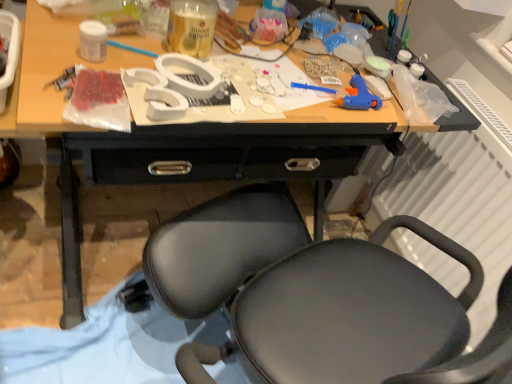
Question: Is blue plastic glue gun at right not inside translucent plastic bottle at upper center, positioned as the first bottle in back-to-front order?

Choices:
 (A) no
 (B) yes

Answer: (B)

Question: Is blue plastic glue gun at right positioned far away from translucent plastic bottle at upper center, the 3th bottle from the front?

Choices:
 (A) yes
 (B) no

Answer: (B)

Question: Could you tell me if blue plastic glue gun at right is turned towards translucent plastic bottle at upper center, acting as the third bottle starting from the left?

Choices:
 (A) no
 (B) yes

Answer: (A)

Question: Is blue plastic glue gun at right further to camera compared to translucent plastic bottle at upper center, positioned as the first bottle in back-to-front order?

Choices:
 (A) no
 (B) yes

Answer: (A)

Question: Is blue plastic glue gun at right closer to camera compared to translucent plastic bottle at upper center, acting as the third bottle starting from the left?

Choices:
 (A) no
 (B) yes

Answer: (B)

Question: Is blue plastic glue gun at right bigger than translucent plastic bottle at upper center, acting as the third bottle starting from the left?

Choices:
 (A) no
 (B) yes

Answer: (B)

Question: Is white plastic radiator at right wider than translucent glass bottle at center, the second bottle from the back?

Choices:
 (A) yes
 (B) no

Answer: (B)

Question: From the image's perspective, is white plastic radiator at right on top of translucent glass bottle at center, the second bottle from the back?

Choices:
 (A) no
 (B) yes

Answer: (A)

Question: Is white plastic radiator at right facing away from translucent glass bottle at center, placed as the second bottle when sorted from left to right?

Choices:
 (A) no
 (B) yes

Answer: (A)

Question: Is white plastic radiator at right to the right of translucent glass bottle at center, which appears as the 2th bottle when viewed from the front, from the viewer's perspective?

Choices:
 (A) no
 (B) yes

Answer: (B)

Question: From a real-world perspective, is white plastic radiator at right located higher than translucent glass bottle at center, which appears as the 2th bottle when viewed from the front?

Choices:
 (A) no
 (B) yes

Answer: (A)

Question: Does white plastic radiator at right come behind translucent glass bottle at center, placed as the second bottle when sorted from left to right?

Choices:
 (A) yes
 (B) no

Answer: (B)

Question: Is the position of white matte jar at upper left, placed as the first bottle when sorted from front to back, more distant than that of white plastic radiator at right?

Choices:
 (A) no
 (B) yes

Answer: (B)